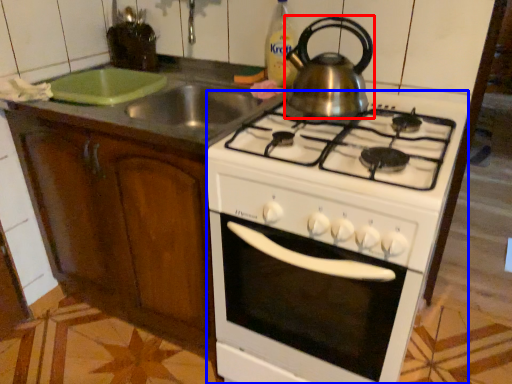
Question: Which of the following is the closest to the observer, kitchen appliance (highlighted by a red box) or oven (highlighted by a blue box)?

Choices:
 (A) kitchen appliance
 (B) oven

Answer: (B)